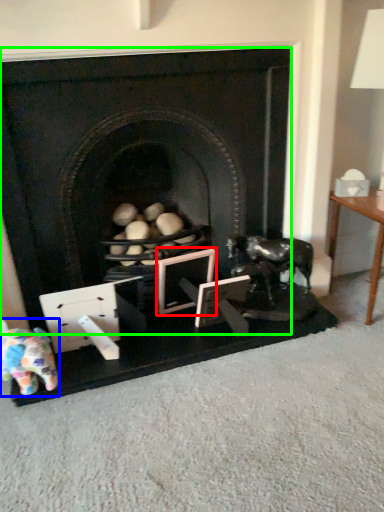
Question: Estimate the real-world distances between objects in this image. Which object is farther from picture frame (highlighted by a red box), toy (highlighted by a blue box) or fireplace (highlighted by a green box)?

Choices:
 (A) toy
 (B) fireplace

Answer: (A)